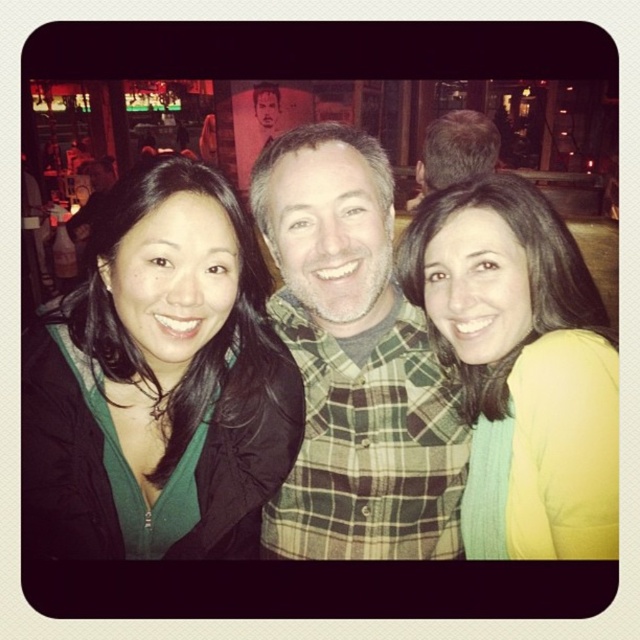
Question: Does green plaid shirt at center appear on the left side of yellow matte sweater at center?

Choices:
 (A) no
 (B) yes

Answer: (B)

Question: Which of the following is the farthest from the observer?

Choices:
 (A) (451, 324)
 (B) (97, 404)
 (C) (368, 406)

Answer: (C)

Question: Estimate the real-world distances between objects in this image. Which object is farther from the yellow matte sweater at center?

Choices:
 (A) green matte jacket at left
 (B) green plaid shirt at center

Answer: (A)

Question: Can you confirm if green matte jacket at left is thinner than green plaid shirt at center?

Choices:
 (A) yes
 (B) no

Answer: (B)

Question: Is green plaid shirt at center smaller than yellow matte sweater at center?

Choices:
 (A) no
 (B) yes

Answer: (A)

Question: Which of the following is the closest to the observer?

Choices:
 (A) green plaid shirt at center
 (B) yellow matte sweater at center
 (C) green matte jacket at left

Answer: (B)